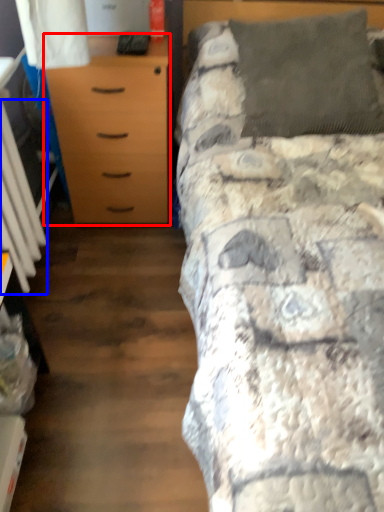
Question: Which of the following is the farthest to the observer, chest of drawers (highlighted by a red box) or radiator (highlighted by a blue box)?

Choices:
 (A) chest of drawers
 (B) radiator

Answer: (A)